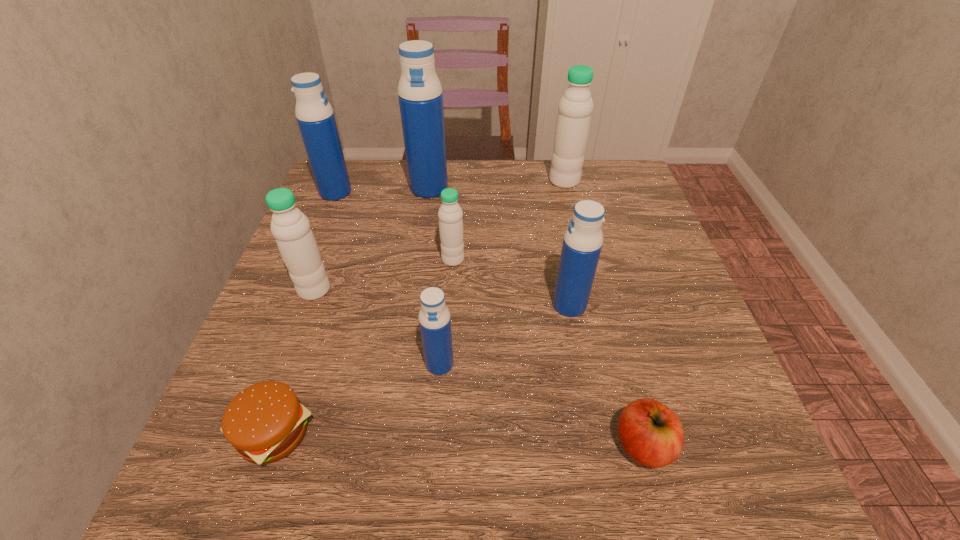
Locate an element on the screen. The height and width of the screenshot is (540, 960). blue water bottle that is the second nearest to the leftmost blue water bottle is located at coordinates (434, 317).

At what (x,y) coordinates should I click in order to perform the action: click on the second closest blue water bottle to the shortest object. Please return your answer as a coordinate pair (x, y). Looking at the image, I should click on (583, 239).

Identify which white water bottle is located as the third nearest to the nearest blue water bottle. Please provide its 2D coordinates. Your answer should be formatted as a tuple, i.e. [(x, y)], where the tuple contains the x and y coordinates of a point satisfying the conditions above.

[(575, 107)]

Where is `white water bottle that can be found as the third closest to the seventh farthest object`? The image size is (960, 540). white water bottle that can be found as the third closest to the seventh farthest object is located at coordinates (575, 107).

Locate an element on the screen. free region that satisfies the following two spatial constraints: 1. on the back side of the tallest water bottle; 2. on the right side of the shortest object is located at coordinates (358, 188).

Find the location of a particular element. blank space that satisfies the following two spatial constraints: 1. on the front side of the second biggest white water bottle; 2. on the right side of the apple is located at coordinates (257, 446).